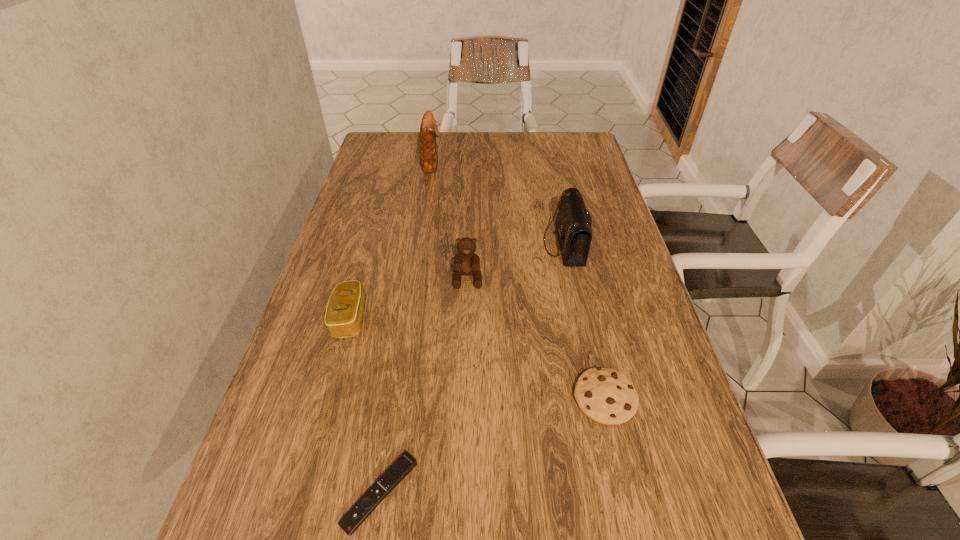
At what (x,y) coordinates should I click in order to perform the action: click on free space that satisfies the following two spatial constraints: 1. on the zipper side of the leftmost object; 2. on the right side of the cookie. Please return your answer as a coordinate pair (x, y). Looking at the image, I should click on (328, 398).